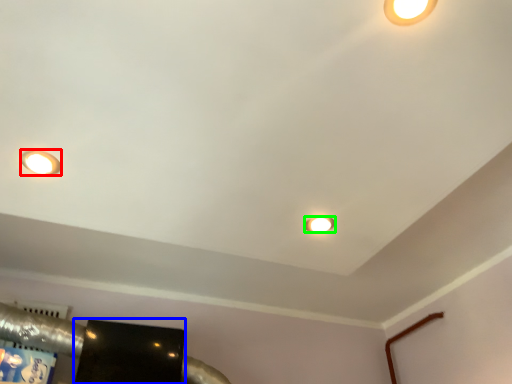
Question: Which object is positioned farthest from lamp (highlighted by a red box)? Select from wide (highlighted by a blue box) and lamp (highlighted by a green box).

Choices:
 (A) wide
 (B) lamp

Answer: (A)